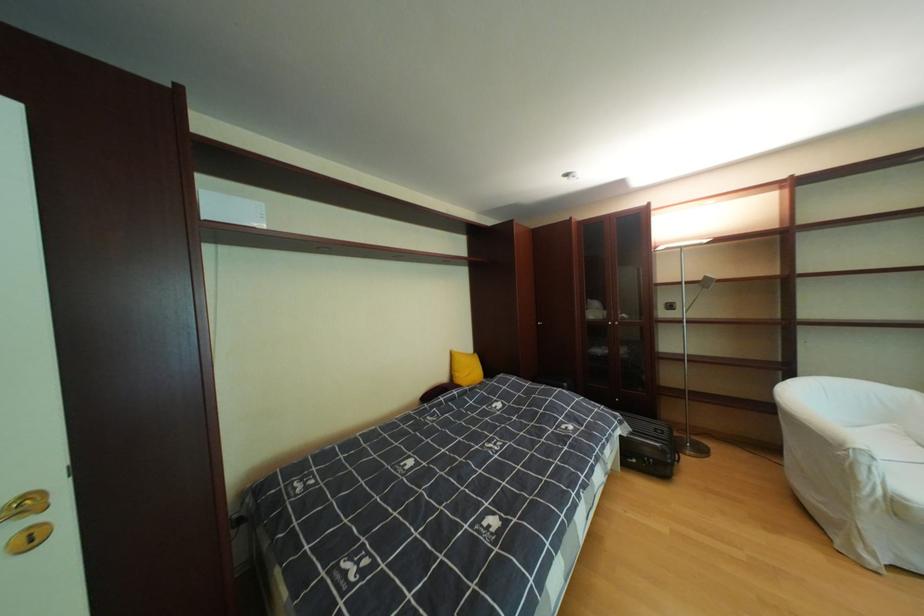
Where would you pull the black suitcase handle? Please return your answer as a coordinate pair (x, y).

(648, 466)